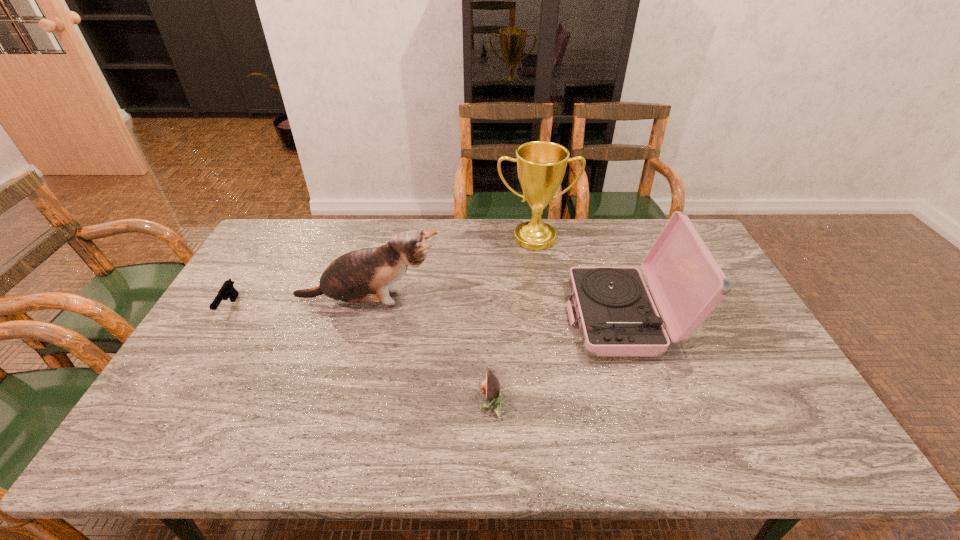
I want to click on free space located 0.160m with the lid open on the record player, so click(x=514, y=318).

Image resolution: width=960 pixels, height=540 pixels. What are the coordinates of `vacant region located 0.240m with the lid open on the record player` in the screenshot? It's located at (487, 318).

Locate an element on the screen. The image size is (960, 540). vacant space located 0.370m at the face of the cat is located at coordinates (562, 300).

Locate an element on the screen. The height and width of the screenshot is (540, 960). vacant space located 0.220m on the seed side of the second shortest object is located at coordinates (390, 402).

Identify the location of blank area located on the seed side of the second shortest object. The width and height of the screenshot is (960, 540). 357,402.

In order to click on vacant space located 0.370m on the seed side of the second shortest object in this screenshot , I will do `click(329, 402)`.

Find the location of `vacant space located on the front-facing side of the shortest object`. vacant space located on the front-facing side of the shortest object is located at coordinates (145, 447).

At what (x,y) coordinates should I click in order to perform the action: click on object positioned at the far edge. Please return your answer as a coordinate pair (x, y). Image resolution: width=960 pixels, height=540 pixels. Looking at the image, I should click on (541, 165).

The image size is (960, 540). I want to click on object that is at the left edge, so 227,290.

The image size is (960, 540). Find the location of `free location at the far edge of the desktop`. free location at the far edge of the desktop is located at coordinates (345, 221).